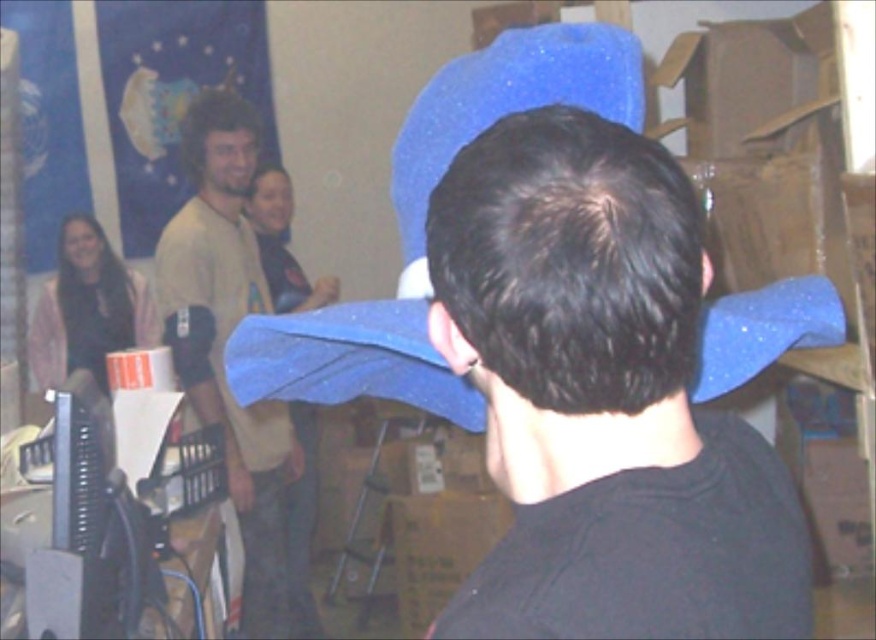
Question: Among these points, which one is nearest to the camera?

Choices:
 (A) (67, 275)
 (B) (524, 419)
 (C) (252, 237)

Answer: (B)

Question: Can you confirm if matte yellow shirt at upper left is wider than matte pink sweater at left?

Choices:
 (A) yes
 (B) no

Answer: (B)

Question: Which is nearer to the matte pink sweater at left?

Choices:
 (A) matte blue hat at center
 (B) blue sparkly hat at center

Answer: (B)

Question: Does blue sparkly hat at center appear on the left side of matte yellow shirt at upper left?

Choices:
 (A) no
 (B) yes

Answer: (A)

Question: Can you confirm if matte blue hat at center is positioned to the right of matte pink sweater at left?

Choices:
 (A) yes
 (B) no

Answer: (A)

Question: Which of the following is the farthest from the observer?

Choices:
 (A) matte pink sweater at left
 (B) blue sparkly hat at center
 (C) matte blue hat at center
 (D) matte yellow shirt at upper left

Answer: (A)